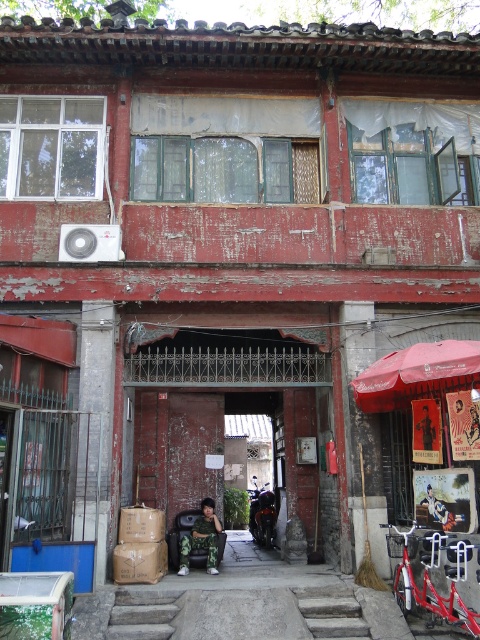
Question: Which of the following is the farthest from the observer?

Choices:
 (A) gray stone stairs at center
 (B) shiny black motorcycle at center
 (C) camouflage uniform at center

Answer: (B)

Question: Among these points, which one is nearest to the camera?

Choices:
 (A) (211, 557)
 (B) (169, 608)
 (C) (273, 534)

Answer: (B)

Question: Is gray stone stairs at center behind shiny black motorcycle at center?

Choices:
 (A) no
 (B) yes

Answer: (A)

Question: Does gray stone stairs at center appear over shiny black motorcycle at center?

Choices:
 (A) no
 (B) yes

Answer: (B)

Question: Considering the real-world distances, which object is farthest from the shiny black motorcycle at center?

Choices:
 (A) camouflage uniform at center
 (B) gray stone stairs at center

Answer: (B)

Question: Does gray stone stairs at center have a lesser width compared to shiny black motorcycle at center?

Choices:
 (A) no
 (B) yes

Answer: (A)